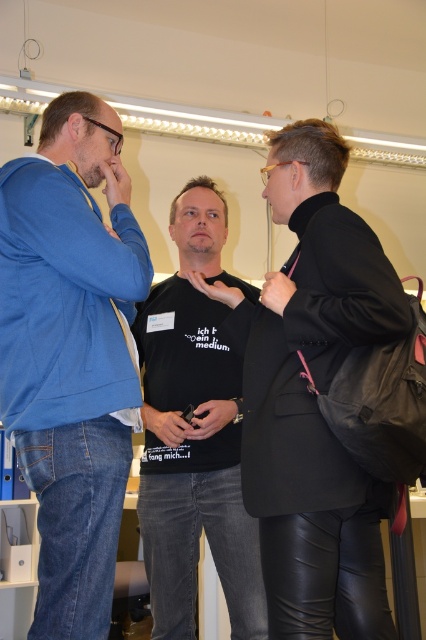
Is point (29, 372) farther from camera compared to point (169, 316)?

No, it is not.

Can you confirm if blue denim jeans at left is bigger than black cotton t-shirt at center?

Incorrect, blue denim jeans at left is not larger than black cotton t-shirt at center.

In order to click on blue denim jeans at left in this screenshot , I will do `click(71, 353)`.

At what (x,y) coordinates should I click in order to perform the action: click on blue denim jeans at left. Please return your answer as a coordinate pair (x, y). Looking at the image, I should click on (71, 353).

Who is lower down, blue denim jeans at left or black matte t-shirt at center?

A: black matte t-shirt at center is lower down.

What do you see at coordinates (71, 353) in the screenshot?
I see `blue denim jeans at left` at bounding box center [71, 353].

Locate an element on the screen. Image resolution: width=426 pixels, height=640 pixels. blue denim jeans at left is located at coordinates (71, 353).

Is black matte t-shirt at center to the left of black cotton t-shirt at center from the viewer's perspective?

No, black matte t-shirt at center is not to the left of black cotton t-shirt at center.

Is point (288, 394) positioned before point (172, 596)?

Yes, it is in front of point (172, 596).

You are a GUI agent. You are given a task and a screenshot of the screen. Output one action in this format:
    pyautogui.click(x=<x>, y=<y>)
    Task: Click on the black matte t-shirt at center
    The height and width of the screenshot is (640, 426).
    Given the screenshot: What is the action you would take?
    pyautogui.click(x=313, y=396)